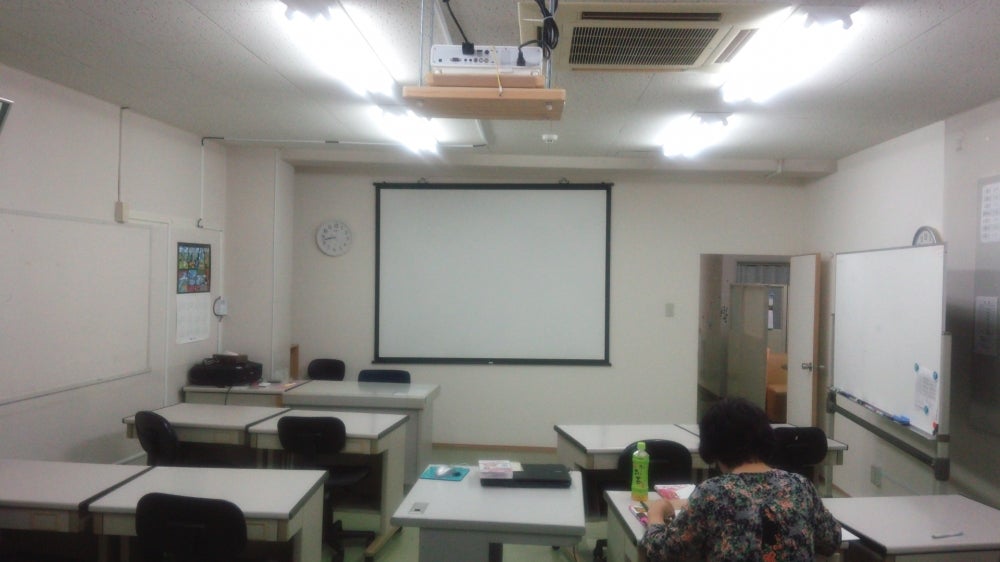
Find the location of a particular element. The image size is (1000, 562). ceiling is located at coordinates (317, 90), (233, 74), (187, 70), (246, 86), (267, 112).